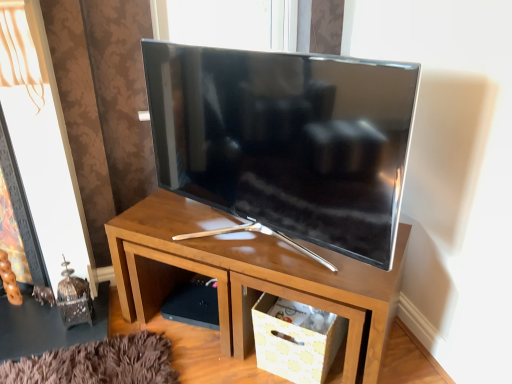
The image size is (512, 384). Find the location of `blank space situated above wooden tv stand at center (from a real-world perspective)`. blank space situated above wooden tv stand at center (from a real-world perspective) is located at coordinates (252, 236).